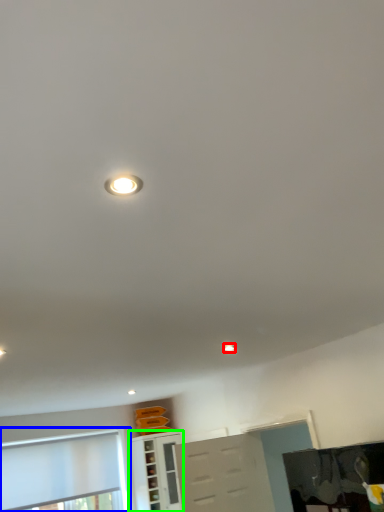
Question: Which object is the closest to the droplight (highlighted by a red box)? Choose among these: window (highlighted by a blue box) or cabinetry (highlighted by a green box).

Choices:
 (A) window
 (B) cabinetry

Answer: (B)